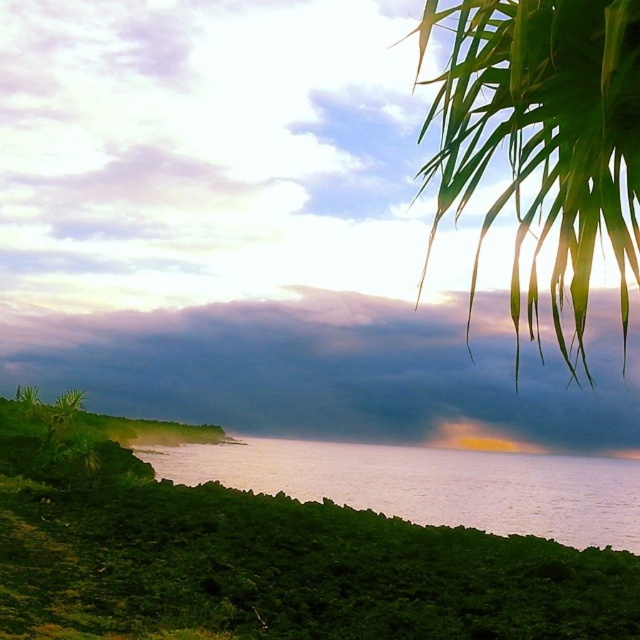
Question: From the image, what is the correct spatial relationship of dark gray cloud at upper center in relation to smooth water at lower left?

Choices:
 (A) below
 (B) above

Answer: (B)

Question: Which object is positioned closest to the smooth water at lower left?

Choices:
 (A) green leafy palm at upper right
 (B) dark gray cloud at upper center

Answer: (B)

Question: Among these points, which one is farthest from the camera?

Choices:
 (A) (484, 54)
 (B) (502, 529)
 (C) (467, 385)

Answer: (C)

Question: Is green leafy palm at upper right to the left of smooth water at lower left from the viewer's perspective?

Choices:
 (A) yes
 (B) no

Answer: (B)

Question: Can you confirm if dark gray cloud at upper center is positioned above smooth water at lower left?

Choices:
 (A) yes
 (B) no

Answer: (A)

Question: Which object appears farthest from the camera in this image?

Choices:
 (A) green leafy palm at upper right
 (B) dark gray cloud at upper center

Answer: (B)